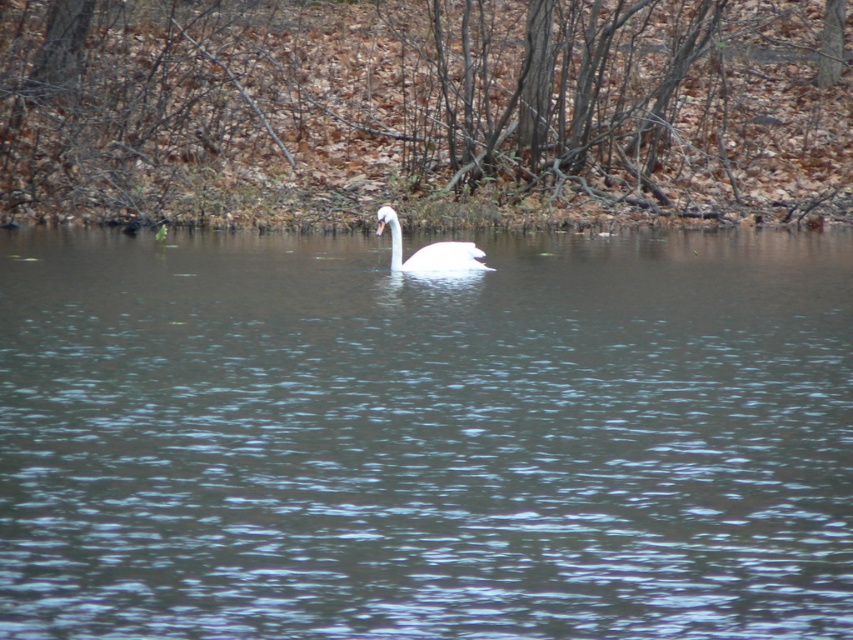
You are a wildlife photographer aiming to capture a closeup shot of the white glossy swan at center. You have a lens with a focal length that allows you to focus on subjects within 9 feet. Are you able to take the photo from your current position at the clear water at center?

The clear water at center is 9.18 feet from the white glossy swan at center. Since your lens can focus within 9 feet, you are just slightly too far away to capture the closeup shot.

You are standing at the edge of the water and want to locate the clear water at center. According to the coordinates provided, in which direction should you look relative to your position?

The clear water at center is located at coordinates point (425,436), so you should look towards the center of the water body to find it.

You are standing at the edge of the pond and notice a point marked at coordinates (425, 436). Based on the scene description, what is the nature of the area where this point is located?

The point at coordinates (425, 436) is located on clear water at center, which means the area there is calm and free of obstructions, making it suitable for swimming or boating.